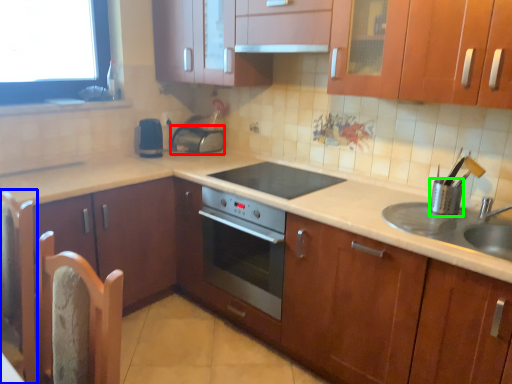
Question: Based on their relative distances, which object is nearer to appliance (highlighted by a red box)? Choose from chair (highlighted by a blue box) and appliance (highlighted by a green box).

Choices:
 (A) chair
 (B) appliance

Answer: (A)